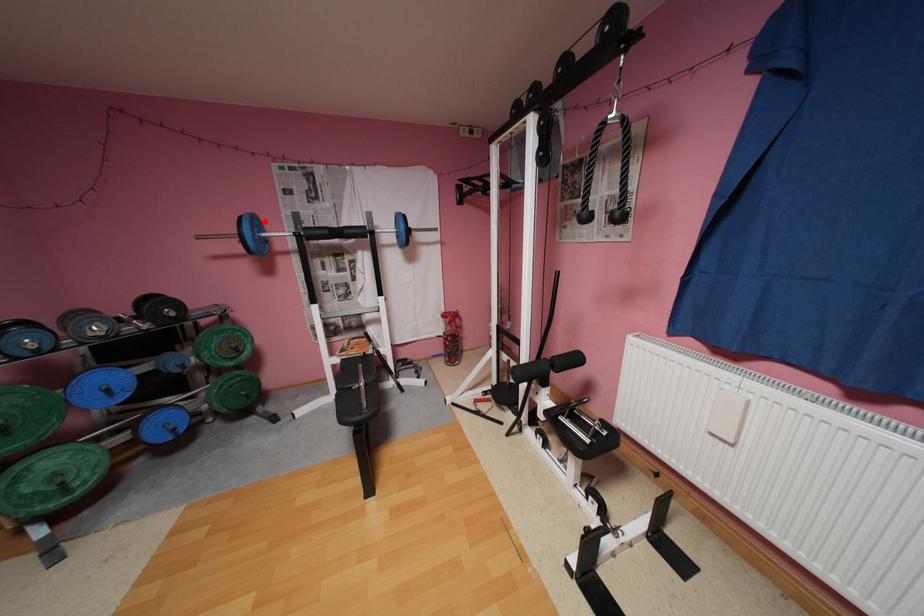
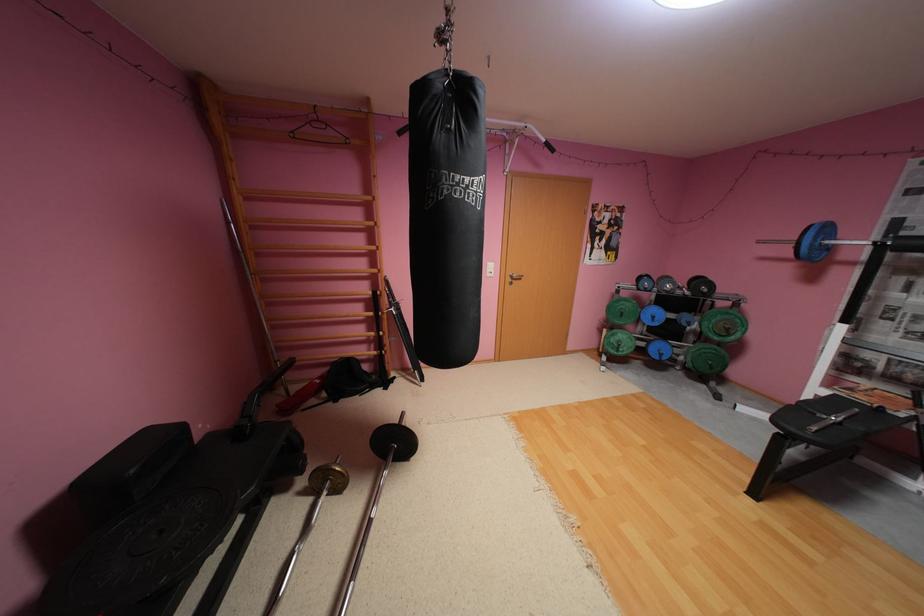
The point at the highlighted location is marked in the first image. Where is the corresponding point in the second image?

(835, 229)